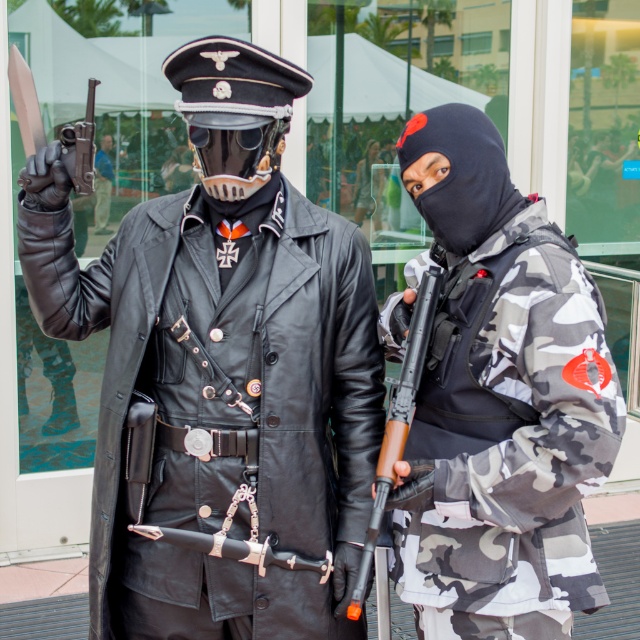
Based on the photo, between black leather coat at center and matte black pistol at left, which one has less height?

matte black pistol at left

Can you confirm if black leather coat at center is bigger than matte black pistol at left?

Indeed, black leather coat at center has a larger size compared to matte black pistol at left.

The height and width of the screenshot is (640, 640). What do you see at coordinates (224, 404) in the screenshot?
I see `black leather coat at center` at bounding box center [224, 404].

Where is `black leather coat at center`? black leather coat at center is located at coordinates (224, 404).

Does point (410, 385) lie behind point (90, 163)?

No.

Which is below, wooden stock rifle at center or matte black pistol at left?

wooden stock rifle at center

Does point (372, 540) come farther from viewer compared to point (90, 84)?

No, it is not.

The image size is (640, 640). Find the location of `wooden stock rifle at center`. wooden stock rifle at center is located at coordinates (397, 419).

Does black leather coat at center have a lesser height compared to camo fabric jacket at right?

Correct, black leather coat at center is not as tall as camo fabric jacket at right.

Who is higher up, black leather coat at center or camo fabric jacket at right?

camo fabric jacket at right

Locate an element on the screen. black leather coat at center is located at coordinates (224, 404).

The image size is (640, 640). Identify the location of black leather coat at center. (224, 404).